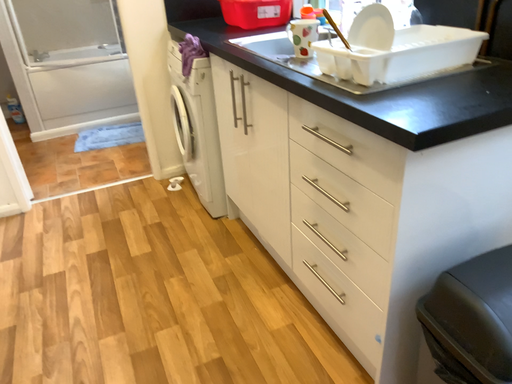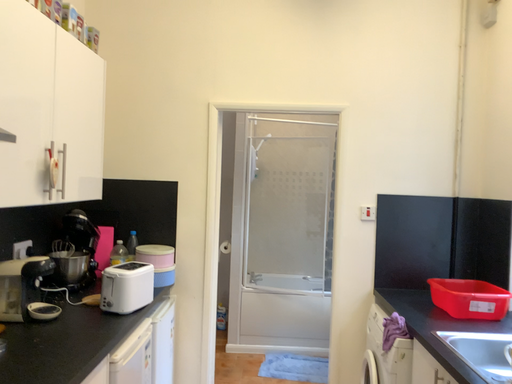
Question: How did the camera likely rotate when shooting the video?

Choices:
 (A) rotated right
 (B) rotated left

Answer: (B)